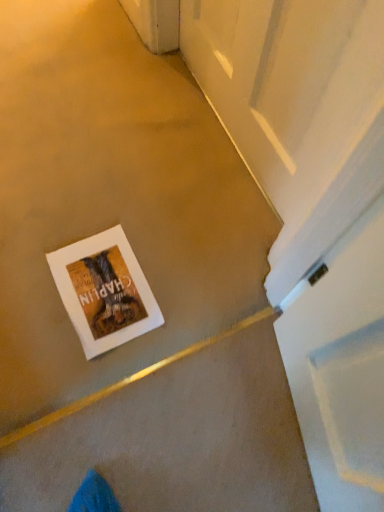
Identify the location of white glossy screen door at upper right. (288, 83).

Measure the distance between point (352, 47) and camera.

A distance of 27.44 inches exists between point (352, 47) and camera.

This screenshot has height=512, width=384. What do you see at coordinates (288, 83) in the screenshot?
I see `white glossy screen door at upper right` at bounding box center [288, 83].

What is the approximate height of white glossy screen door at upper right?

It is 24.37 inches.

You are a GUI agent. You are given a task and a screenshot of the screen. Output one action in this format:
    pyautogui.click(x=<x>, y=<y>)
    Task: Click on the white paper postcard at center
    
    Given the screenshot: What is the action you would take?
    pyautogui.click(x=104, y=291)

What do you see at coordinates (104, 291) in the screenshot?
I see `white paper postcard at center` at bounding box center [104, 291].

In order to face white paper postcard at center, should I rotate leftwards or rightwards?

A 11.938 degree turn to the left will do.

Find the location of a particular element. white glossy screen door at upper right is located at coordinates (288, 83).

Between white paper postcard at center and white glossy screen door at upper right, which one appears on the right side from the viewer's perspective?

Positioned to the right is white glossy screen door at upper right.

Is white paper postcard at center further to camera compared to white glossy screen door at upper right?

Yes, white paper postcard at center is further from the camera.

Is point (143, 289) more distant than point (252, 38)?

Yes.

From the image's perspective, does white paper postcard at center appear lower than white glossy screen door at upper right?

Correct, white paper postcard at center appears lower than white glossy screen door at upper right in the image.

From a real-world perspective, is white paper postcard at center under white glossy screen door at upper right?

Yes, from a real-world perspective, white paper postcard at center is below white glossy screen door at upper right.

Between white paper postcard at center and white glossy screen door at upper right, which one has larger width?

With larger width is white paper postcard at center.

Considering the relative sizes of white paper postcard at center and white glossy screen door at upper right in the image provided, is white paper postcard at center taller than white glossy screen door at upper right?

In fact, white paper postcard at center may be shorter than white glossy screen door at upper right.

In terms of size, does white paper postcard at center appear bigger or smaller than white glossy screen door at upper right?

Clearly, white paper postcard at center is smaller in size than white glossy screen door at upper right.

Is white paper postcard at center inside the boundaries of white glossy screen door at upper right, or outside?

white paper postcard at center is outside white glossy screen door at upper right.

Are white paper postcard at center and white glossy screen door at upper right beside each other?

No, white paper postcard at center is not making contact with white glossy screen door at upper right.

Is white paper postcard at center positioned with its back to white glossy screen door at upper right?

white paper postcard at center does not have its back to white glossy screen door at upper right.

What's the angular difference between white paper postcard at center and white glossy screen door at upper right's facing directions?

The angle between the facing direction of white paper postcard at center and the facing direction of white glossy screen door at upper right is 89.6 degrees.

At what (x,y) coordinates should I click in order to perform the action: click on screen door in front of the white paper postcard at center. Please return your answer as a coordinate pair (x, y). Looking at the image, I should click on (288, 83).

Can you confirm if white glossy screen door at upper right is positioned to the left of white paper postcard at center?

In fact, white glossy screen door at upper right is to the right of white paper postcard at center.

Between white glossy screen door at upper right and white paper postcard at center, which one is positioned in front?

white glossy screen door at upper right is in front.

Is point (241, 106) more distant than point (114, 306)?

Yes, it is.

From the image's perspective, between white glossy screen door at upper right and white paper postcard at center, which one is located above?

white glossy screen door at upper right appears higher in the image.

From a real-world perspective, between white glossy screen door at upper right and white paper postcard at center, who is vertically lower?

white paper postcard at center, from a real-world perspective.

From the picture: Considering the relative sizes of white glossy screen door at upper right and white paper postcard at center in the image provided, is white glossy screen door at upper right wider than white paper postcard at center?

No, white glossy screen door at upper right is not wider than white paper postcard at center.

In terms of height, does white glossy screen door at upper right look taller or shorter compared to white paper postcard at center?

Clearly, white glossy screen door at upper right is taller compared to white paper postcard at center.

Considering the sizes of white glossy screen door at upper right and white paper postcard at center in the image, is white glossy screen door at upper right bigger or smaller than white paper postcard at center?

Clearly, white glossy screen door at upper right is larger in size than white paper postcard at center.

Which is correct: white glossy screen door at upper right is inside white paper postcard at center, or outside of it?

white glossy screen door at upper right is outside white paper postcard at center.

Would you consider white glossy screen door at upper right to be distant from white paper postcard at center?

No, there isn't a large distance between white glossy screen door at upper right and white paper postcard at center.

Is white glossy screen door at upper right aimed at white paper postcard at center?

Yes, white glossy screen door at upper right is turned towards white paper postcard at center.

How distant is white glossy screen door at upper right from white paper postcard at center?

white glossy screen door at upper right and white paper postcard at center are 21.26 inches apart from each other.

At what (x,y) coordinates should I click in order to perform the action: click on postcard to the left of white glossy screen door at upper right. Please return your answer as a coordinate pair (x, y). Looking at the image, I should click on (104, 291).

The height and width of the screenshot is (512, 384). Find the location of `postcard located on the left of white glossy screen door at upper right`. postcard located on the left of white glossy screen door at upper right is located at coordinates (104, 291).

This screenshot has height=512, width=384. Identify the location of postcard directly beneath the white glossy screen door at upper right (from a real-world perspective). (104, 291).